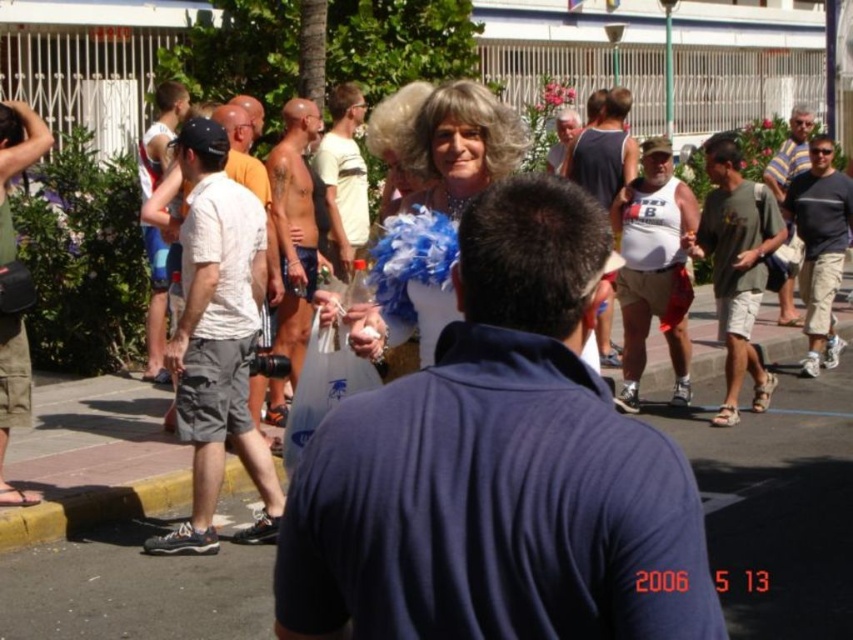
Does white tank top at center appear on the right side of matte white shirt at center?

Yes, white tank top at center is to the right of matte white shirt at center.

Locate an element on the screen. white tank top at center is located at coordinates (602, 148).

Which is in front, point (621, 113) or point (547, 160)?

Point (621, 113)

At what (x,y) coordinates should I click in order to perform the action: click on white tank top at center. Please return your answer as a coordinate pair (x, y). Image resolution: width=853 pixels, height=640 pixels. Looking at the image, I should click on (602, 148).

What do you see at coordinates (654, 269) in the screenshot?
I see `white cotton tank top at center-right` at bounding box center [654, 269].

Between white cotton tank top at center-right and striped cotton shirt at right, which one appears on the left side from the viewer's perspective?

white cotton tank top at center-right

Identify the location of white cotton tank top at center-right. The image size is (853, 640). (654, 269).

Does white cotton tank top at center-right have a smaller size compared to dark gray cotton shirt at right?

Indeed, white cotton tank top at center-right has a smaller size compared to dark gray cotton shirt at right.

Can you confirm if white cotton tank top at center-right is thinner than dark gray cotton shirt at right?

Correct, white cotton tank top at center-right's width is less than dark gray cotton shirt at right's.

This screenshot has height=640, width=853. Find the location of `white cotton tank top at center-right`. white cotton tank top at center-right is located at coordinates (654, 269).

Where is `white cotton tank top at center-right`? This screenshot has height=640, width=853. white cotton tank top at center-right is located at coordinates (654, 269).